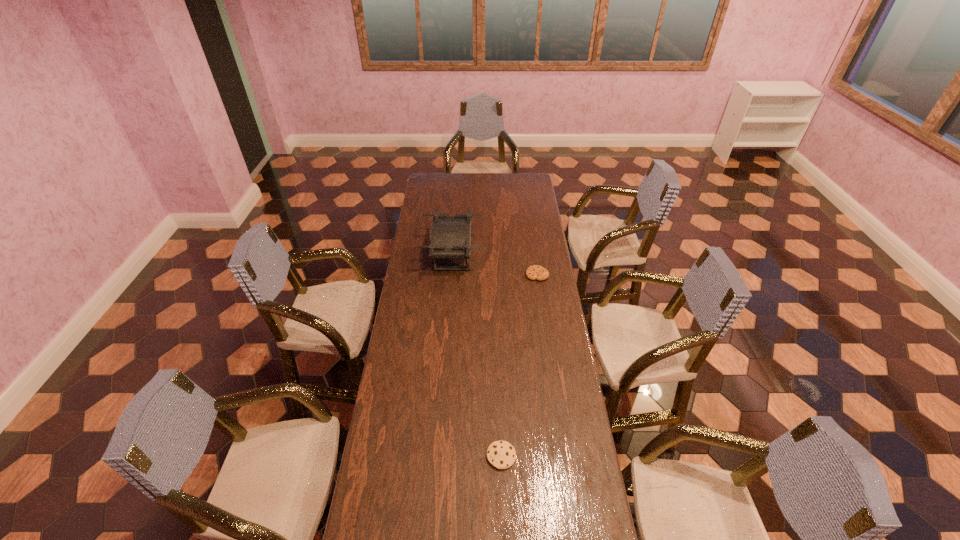
Identify which object is the nearest to the tallest object. Please provide its 2D coordinates. Your answer should be formatted as a tuple, i.e. [(x, y)], where the tuple contains the x and y coordinates of a point satisfying the conditions above.

[(535, 272)]

Identify the location of cookie that is the second nearest to the drone. This screenshot has height=540, width=960. (501, 454).

The width and height of the screenshot is (960, 540). I want to click on free space that satisfies the following two spatial constraints: 1. with a camera mounted on the underside of the leftmost object; 2. on the right side of the left cookie, so click(x=438, y=456).

Locate an element on the screen. vacant space that satisfies the following two spatial constraints: 1. on the back side of the left cookie; 2. on the left side of the rightmost object is located at coordinates (494, 275).

You are a GUI agent. You are given a task and a screenshot of the screen. Output one action in this format:
    pyautogui.click(x=<x>, y=<y>)
    Task: Click on the vacant space that satisfies the following two spatial constraints: 1. on the back side of the rightmost object; 2. with a camera mounted on the underside of the leftmost object
    This screenshot has height=540, width=960.
    Given the screenshot: What is the action you would take?
    point(535,256)

Identify the location of vacant area that satisfies the following two spatial constraints: 1. with a camera mounted on the underside of the tallest object; 2. on the right side of the nearest object. point(438,456).

Identify the location of free location that satisfies the following two spatial constraints: 1. with a camera mounted on the underside of the tallest object; 2. on the back side of the second object from right to left. Image resolution: width=960 pixels, height=540 pixels. (438, 456).

Image resolution: width=960 pixels, height=540 pixels. In order to click on vacant space that satisfies the following two spatial constraints: 1. with a camera mounted on the underside of the left cookie; 2. on the right side of the drone in this screenshot , I will do `click(438, 456)`.

This screenshot has width=960, height=540. I want to click on free region that satisfies the following two spatial constraints: 1. on the back side of the rightmost object; 2. with a camera mounted on the underside of the drone, so click(535, 256).

Image resolution: width=960 pixels, height=540 pixels. Find the location of `free space that satisfies the following two spatial constraints: 1. with a camera mounted on the underside of the tallest object; 2. on the back side of the nearer cookie`. free space that satisfies the following two spatial constraints: 1. with a camera mounted on the underside of the tallest object; 2. on the back side of the nearer cookie is located at coordinates (438, 456).